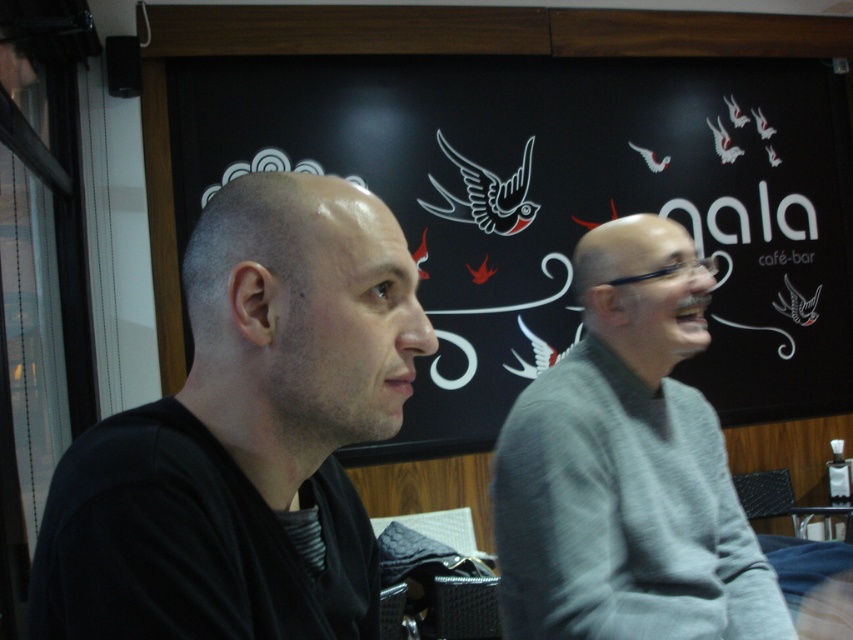
You are a photographer taking a picture of the two points in the image. Which point, point (518, 564) or point (830, 504), will appear larger in your photo?

Point (518, 564) will appear larger in the photo because it is closer to the camera than point (830, 504).